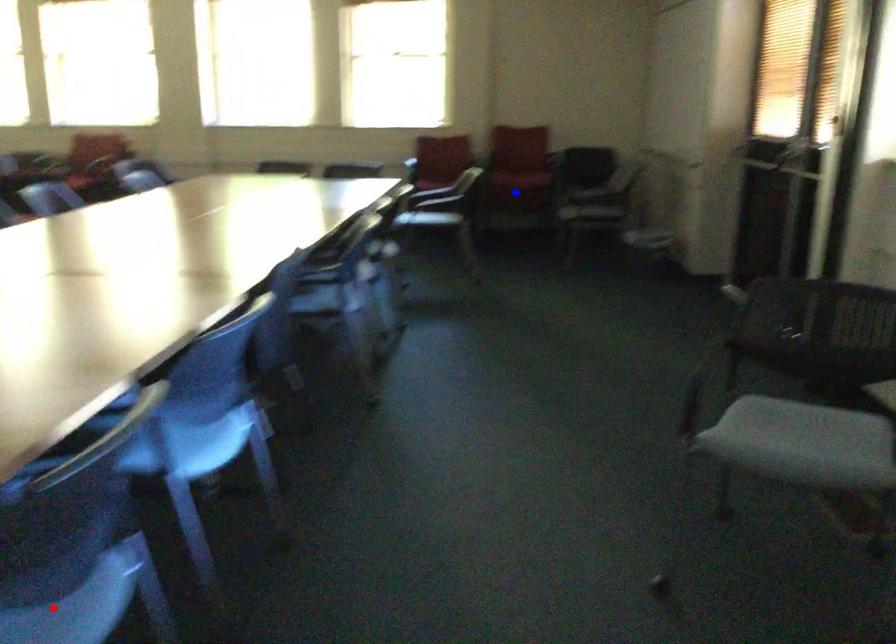
Question: Which of the two points in the image is closer to the camera?

Choices:
 (A) Blue point is closer.
 (B) Red point is closer.

Answer: (B)